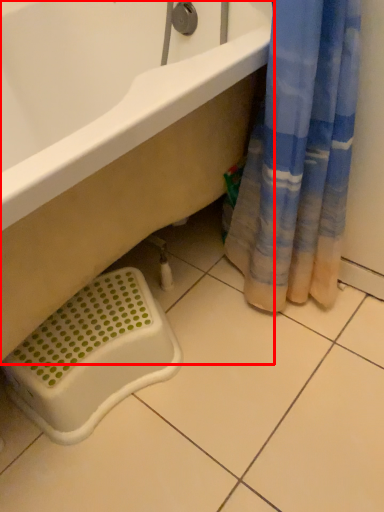
Question: From the image's perspective, where is bathtub (annotated by the red box) located in relation to laundry basket in the image?

Choices:
 (A) above
 (B) below

Answer: (A)